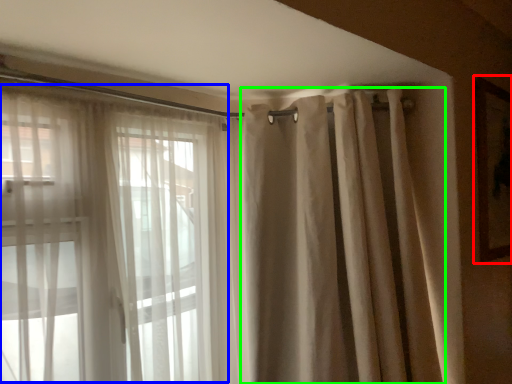
Question: Based on their relative distances, which object is nearer to picture frame (highlighted by a red box)? Choose from bay window (highlighted by a blue box) and shower curtain (highlighted by a green box).

Choices:
 (A) bay window
 (B) shower curtain

Answer: (B)